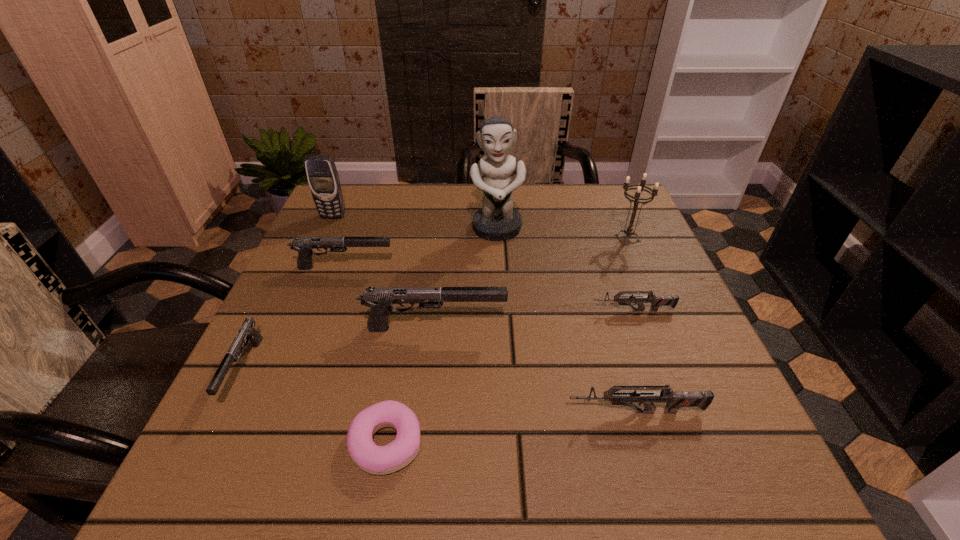
Identify which gun is the nearest to the second shortest object. Please provide its 2D coordinates. Your answer should be formatted as a tuple, i.e. [(x, y)], where the tuple contains the x and y coordinates of a point satisfying the conditions above.

[(379, 299)]

Locate an element on the screen. Image resolution: width=960 pixels, height=540 pixels. the closest gun relative to the fifth farthest object is located at coordinates (379, 299).

Identify the location of the third closest gray gun to the pink pastry. (304, 245).

Where is `the second closest gray gun relative to the bigger grey gun`? Image resolution: width=960 pixels, height=540 pixels. the second closest gray gun relative to the bigger grey gun is located at coordinates [304, 245].

Find the location of `free location that satisfies the following two spatial constraints: 1. on the front face of the candle holder; 2. on the left side of the cellular telephone`. free location that satisfies the following two spatial constraints: 1. on the front face of the candle holder; 2. on the left side of the cellular telephone is located at coordinates (324, 238).

I want to click on free space that satisfies the following two spatial constraints: 1. on the back side of the pink pastry; 2. at the muzzle end of the farthest gray gun, so click(417, 267).